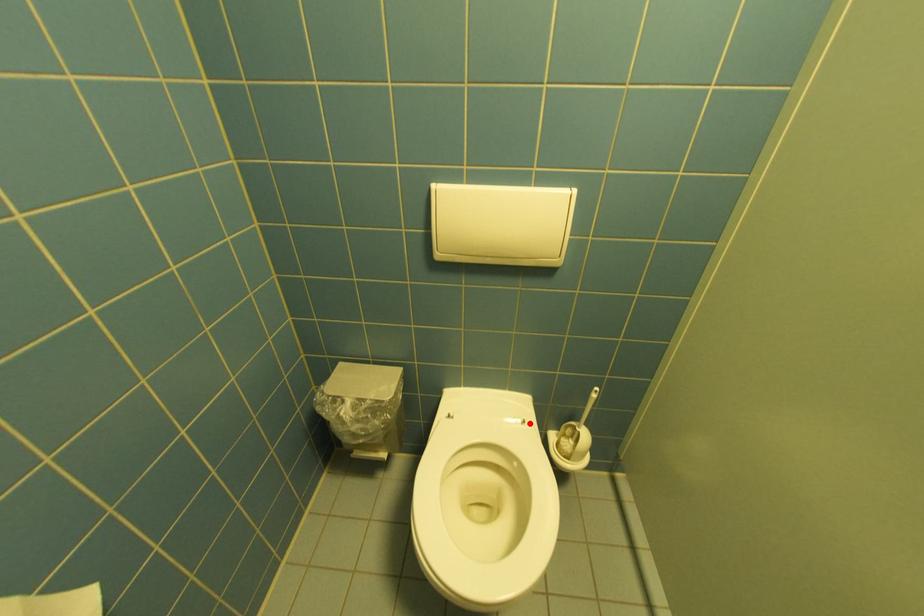
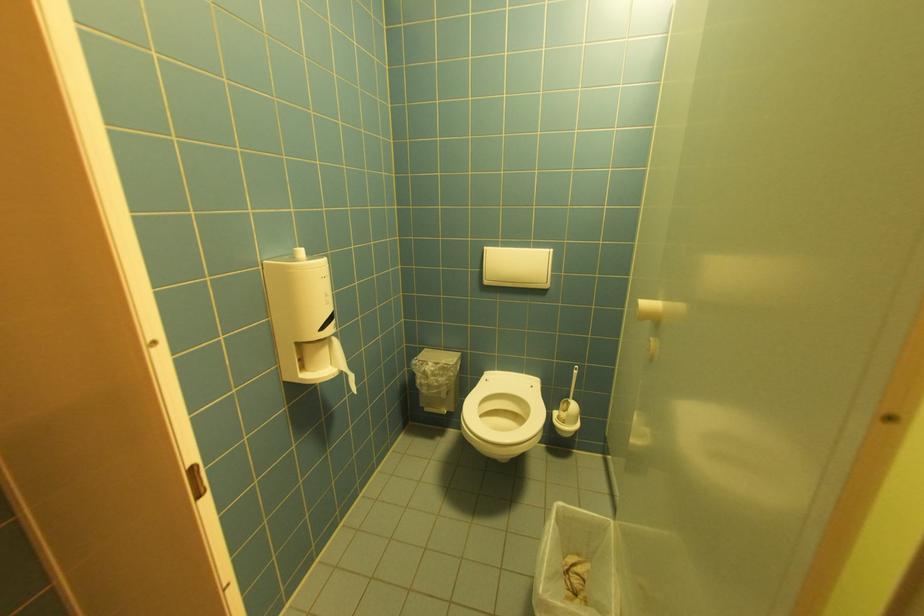
The point at the highlighted location is marked in the first image. Where is the corresponding point in the second image?

(538, 387)